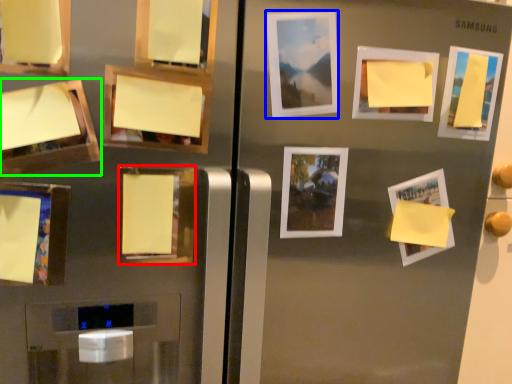
Question: Based on their relative distances, which object is nearer to picture frame (highlighted by a red box)? Choose from picture frame (highlighted by a blue box) and picture frame (highlighted by a green box).

Choices:
 (A) picture frame
 (B) picture frame

Answer: (B)